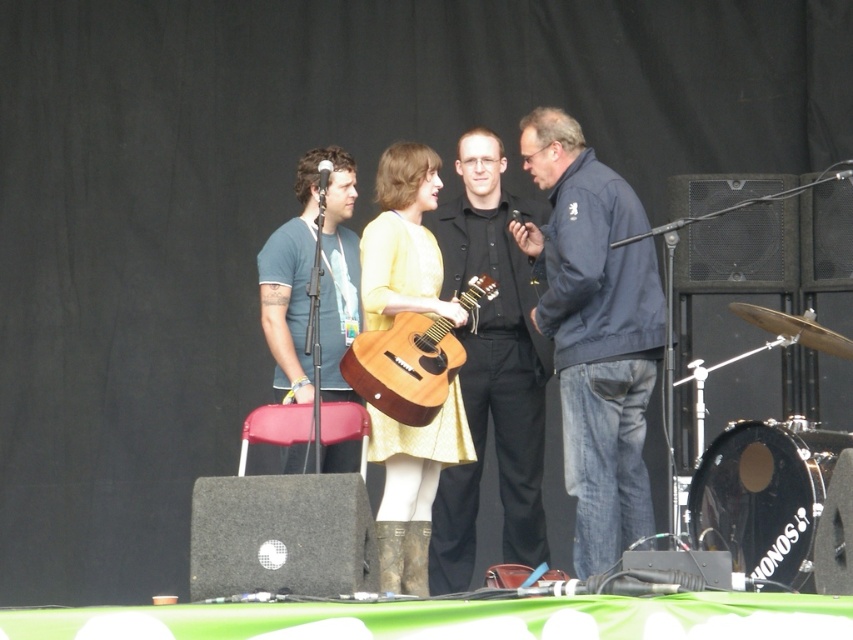
Question: Which of the following is the farthest from the observer?

Choices:
 (A) click(630, 328)
 (B) click(410, 365)

Answer: (A)

Question: Is black matte shirt at center to the left of wooden acoustic guitar at center from the viewer's perspective?

Choices:
 (A) yes
 (B) no

Answer: (B)

Question: Can you confirm if black matte shirt at center is smaller than matte blue shirt at center?

Choices:
 (A) no
 (B) yes

Answer: (B)

Question: Which of the following is the farthest from the observer?

Choices:
 (A) (619, 291)
 (B) (532, 500)

Answer: (B)

Question: Which object is positioned closest to the black matte shirt at center?

Choices:
 (A) dark blue jacket at center
 (B) matte blue shirt at center
 (C) wooden acoustic guitar at center
 (D) matte yellow dress at center

Answer: (B)

Question: Does dark blue jacket at center have a smaller size compared to matte yellow dress at center?

Choices:
 (A) yes
 (B) no

Answer: (B)